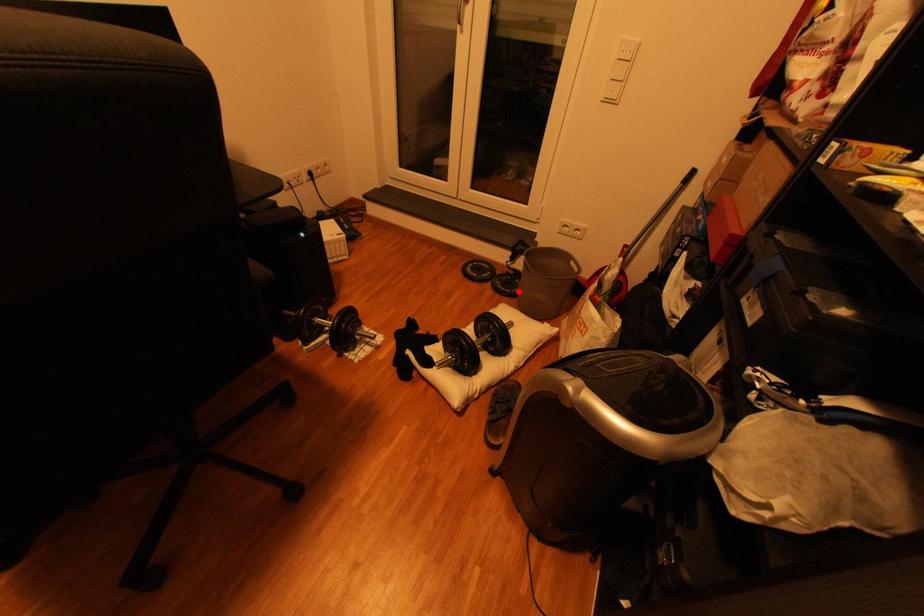
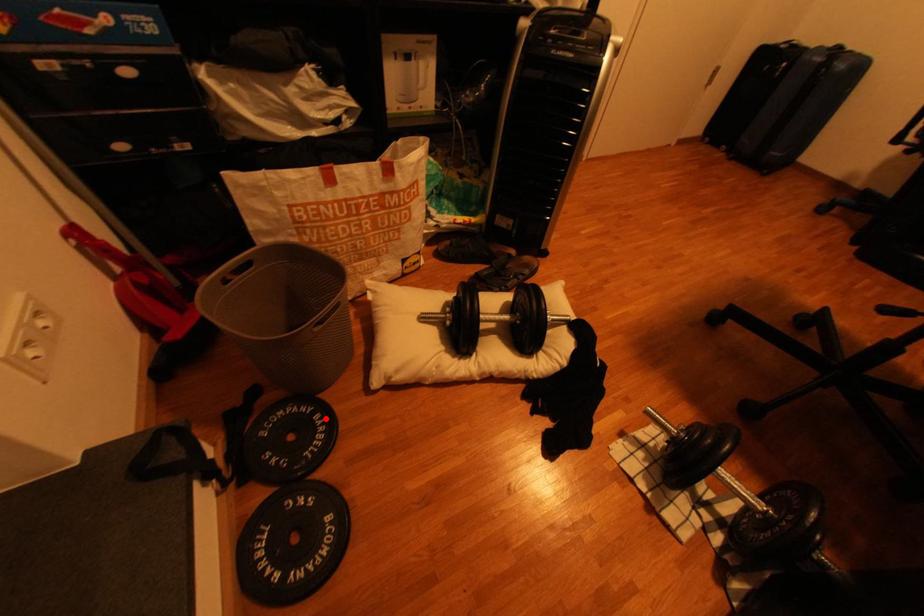
I am providing you with two images of the same scene from different viewpoints. A red point is marked on the first image and another point is marked on the second image. Is the marked point in image1 the same physical position as the marked point in image2?

Yes